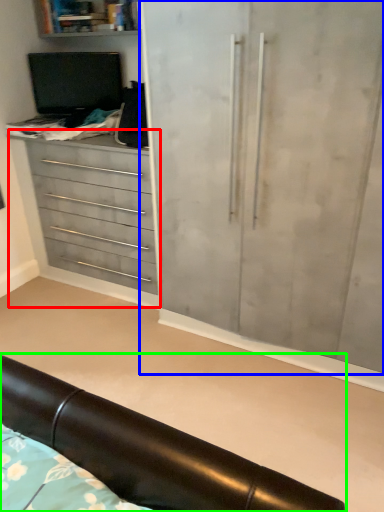
Question: Which object is positioned closest to chest of drawers (highlighted by a red box)? Select from cupboard (highlighted by a blue box) and furniture (highlighted by a green box).

Choices:
 (A) cupboard
 (B) furniture

Answer: (A)